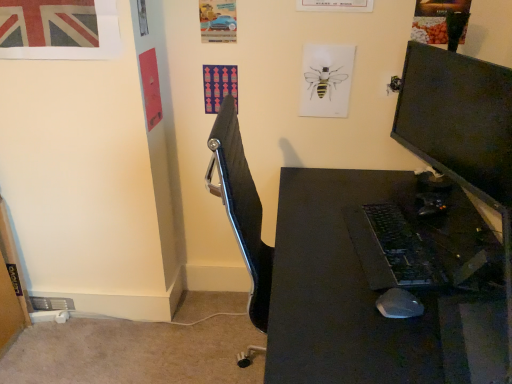
This screenshot has height=384, width=512. What are the coordinates of `vacant area in front of black plastic mouse at lower right` in the screenshot? It's located at (404, 346).